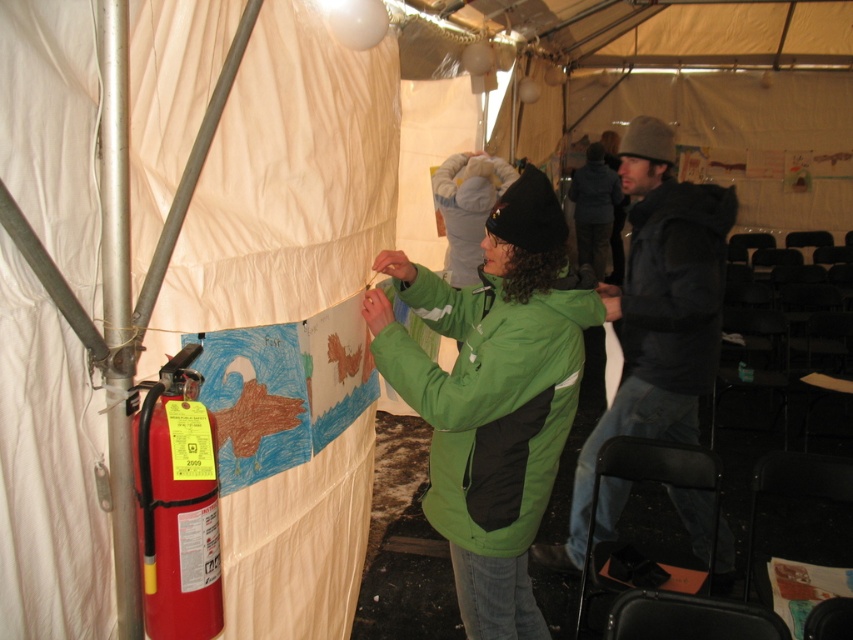
Question: Which of the following is the closest to the observer?

Choices:
 (A) (416, 269)
 (B) (685, 364)
 (C) (165, 586)

Answer: (C)

Question: Can you confirm if black jacket at center is smaller than black matte jacket at right?

Choices:
 (A) yes
 (B) no

Answer: (B)

Question: Which point is farther to the camera?

Choices:
 (A) black matte jacket at right
 (B) black jacket at center
 (C) red matte fire extinguisher at lower left
 (D) green/waterproof jacket at center

Answer: (A)

Question: Where is green/waterproof jacket at center located in relation to black matte jacket at right in the image?

Choices:
 (A) below
 (B) above

Answer: (A)

Question: Can you confirm if black jacket at center is positioned above black matte jacket at right?

Choices:
 (A) yes
 (B) no

Answer: (B)

Question: Which of the following is the farthest from the observer?

Choices:
 (A) black jacket at center
 (B) red matte fire extinguisher at lower left

Answer: (A)